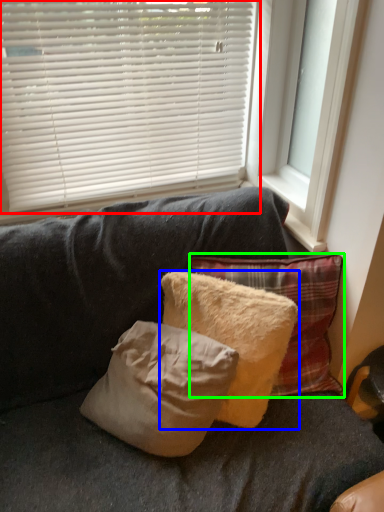
Question: Which object is positioned farthest from window blind (highlighted by a red box)? Select from pillow (highlighted by a blue box) and pillow (highlighted by a green box).

Choices:
 (A) pillow
 (B) pillow

Answer: (A)